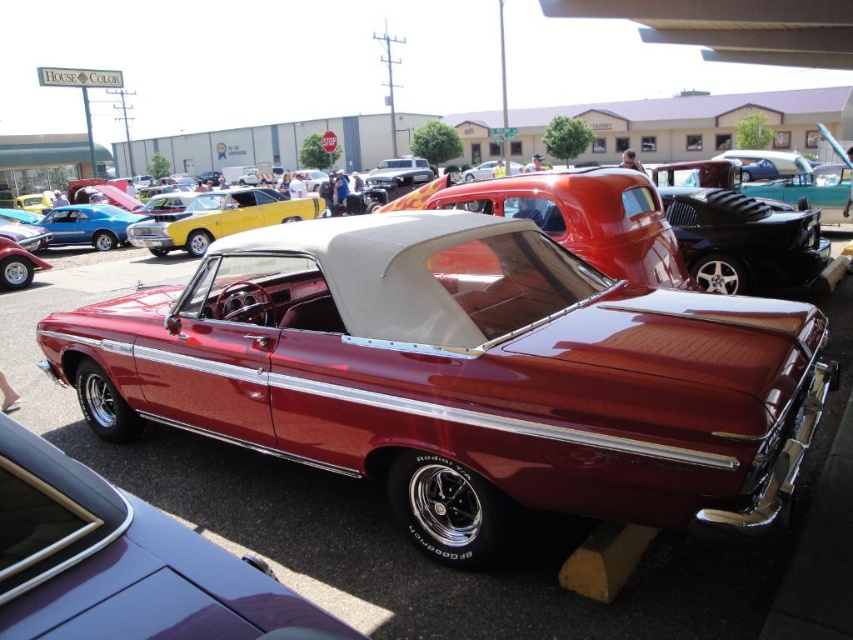
You are standing at the entrance of the car show and want to take a photo of both the red convertible in the foreground and the bright yellow muscle car to the left. The two points you need to focus on are point (749,348) and point (387,170). Which point should you focus on to ensure both cars are in clear focus?

Point (749,348) is closer to the camera than point (387,170). To ensure both cars are in clear focus, you should focus on the closer point, which is point (749,348).